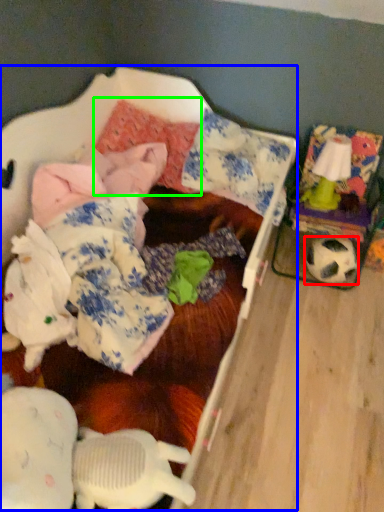
Question: Which object is the farthest from football (highlighted by a red box)? Choose among these: bed (highlighted by a blue box) or pillow (highlighted by a green box).

Choices:
 (A) bed
 (B) pillow

Answer: (B)